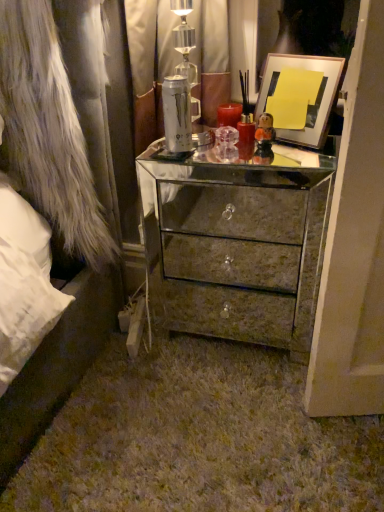
Question: Is metallic silver picture frame at upper right bigger or smaller than mirrored metallic chest of drawers at center?

Choices:
 (A) small
 (B) big

Answer: (A)

Question: Would you say metallic silver picture frame at upper right is inside or outside mirrored metallic chest of drawers at center?

Choices:
 (A) outside
 (B) inside

Answer: (A)

Question: Which object is the farthest from the metallic silver picture frame at upper right?

Choices:
 (A) mirrored metallic chest of drawers at center
 (B) white fur coat at left

Answer: (B)

Question: Based on their relative distances, which object is farther from the metallic silver picture frame at upper right?

Choices:
 (A) white fur coat at left
 (B) mirrored metallic chest of drawers at center

Answer: (A)